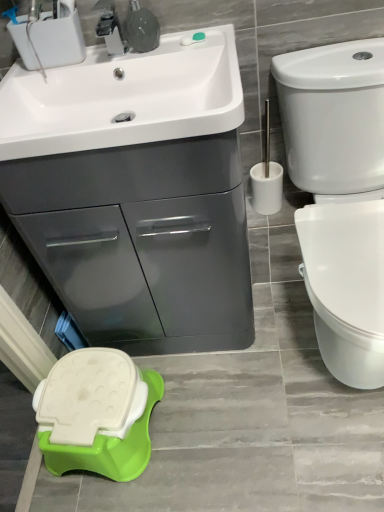
I want to click on unoccupied region to the right of green plastic stool at lower left, so click(x=177, y=416).